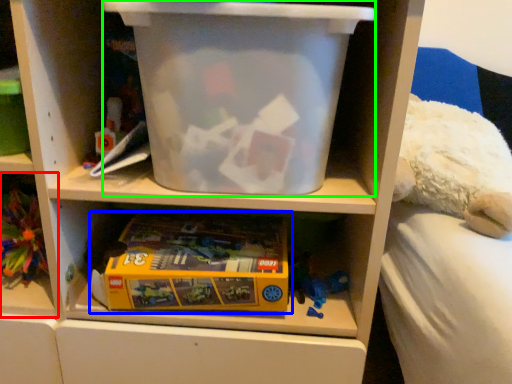
Question: Estimate the real-world distances between objects in this image. Which object is farther from shelf (highlighted by a red box), toy (highlighted by a blue box) or storage box (highlighted by a green box)?

Choices:
 (A) toy
 (B) storage box

Answer: (B)